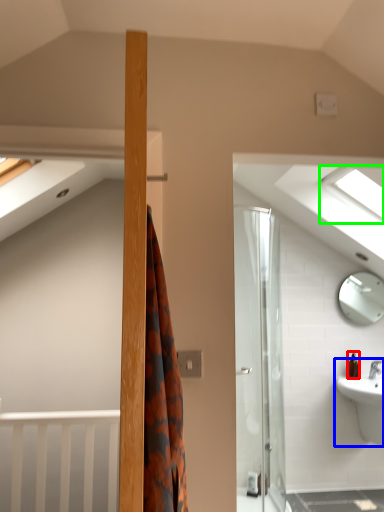
Question: Which object is the farthest from toiletry (highlighted by a red box)? Choose among these: sink (highlighted by a blue box) or window (highlighted by a green box).

Choices:
 (A) sink
 (B) window

Answer: (B)